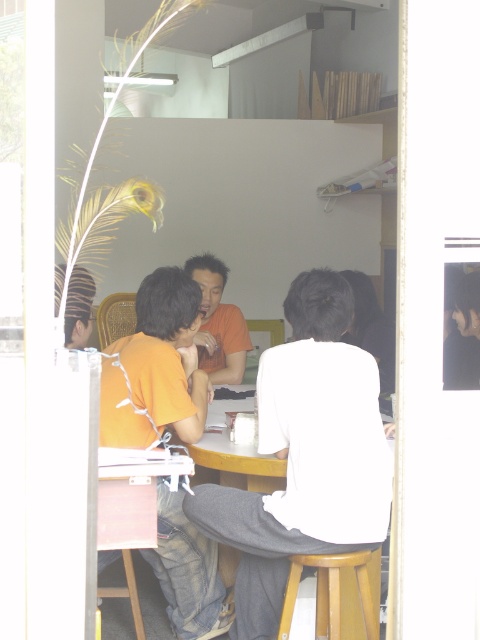
In the scene shown: Between orange cotton shirt at center and wooden table at lower center, which one is positioned lower?

orange cotton shirt at center is lower down.

Is point (104, 394) farther from camera compared to point (146, 496)?

Yes, it is behind point (146, 496).

Who is more forward, (128, 403) or (135, 488)?

Positioned in front is point (135, 488).

Locate an element on the screen. The height and width of the screenshot is (640, 480). orange cotton shirt at center is located at coordinates (156, 368).

Is wooden table at lower center above wooden stool at lower center?

Correct, wooden table at lower center is located above wooden stool at lower center.

Does point (129, 515) come farther from viewer compared to point (285, 625)?

No, it is not.

What are the coordinates of `wooden table at lower center` in the screenshot? It's located at (132, 509).

Between wooden table at lower center and orange matte shirt at center, which one is positioned lower?

wooden table at lower center

Image resolution: width=480 pixels, height=640 pixels. Describe the element at coordinates (132, 509) in the screenshot. I see `wooden table at lower center` at that location.

Locate an element on the screen. The height and width of the screenshot is (640, 480). wooden table at lower center is located at coordinates (132, 509).